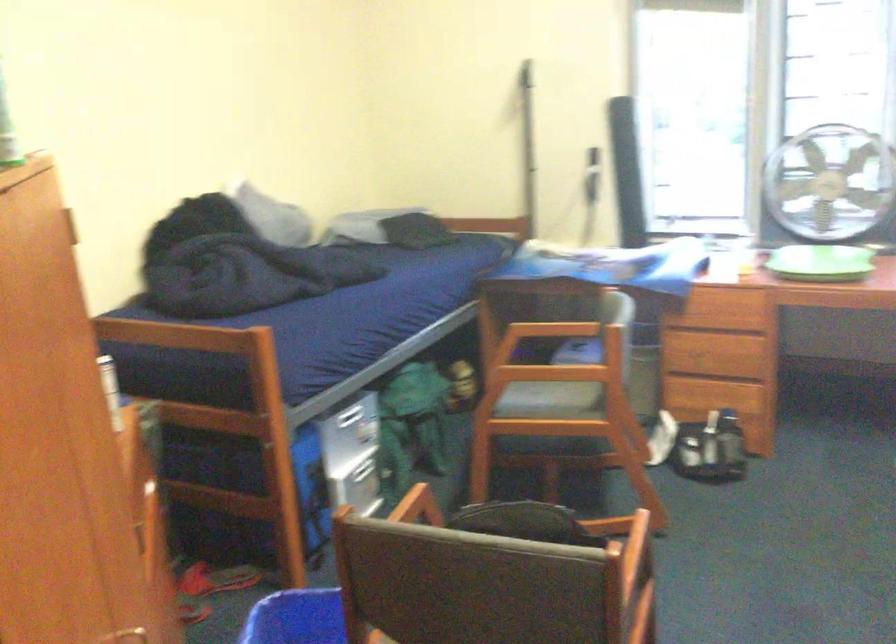
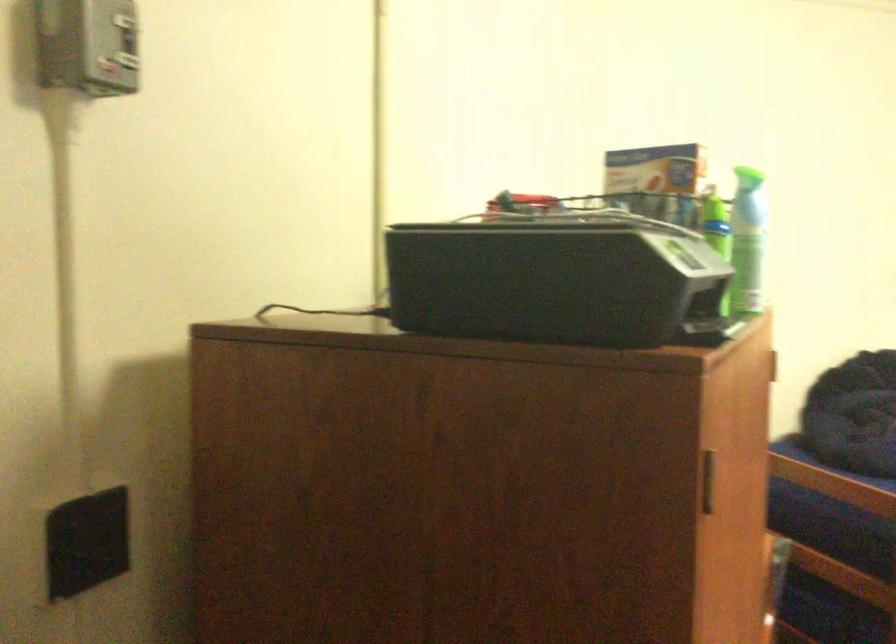
Question: How did the camera likely rotate?

Choices:
 (A) Left
 (B) Right
 (C) Up
 (D) Down

Answer: (A)